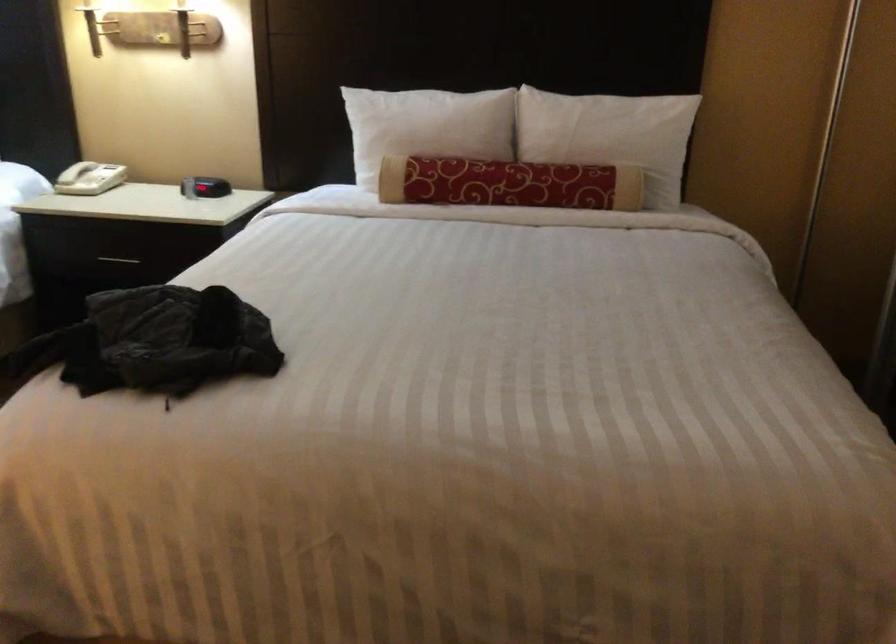
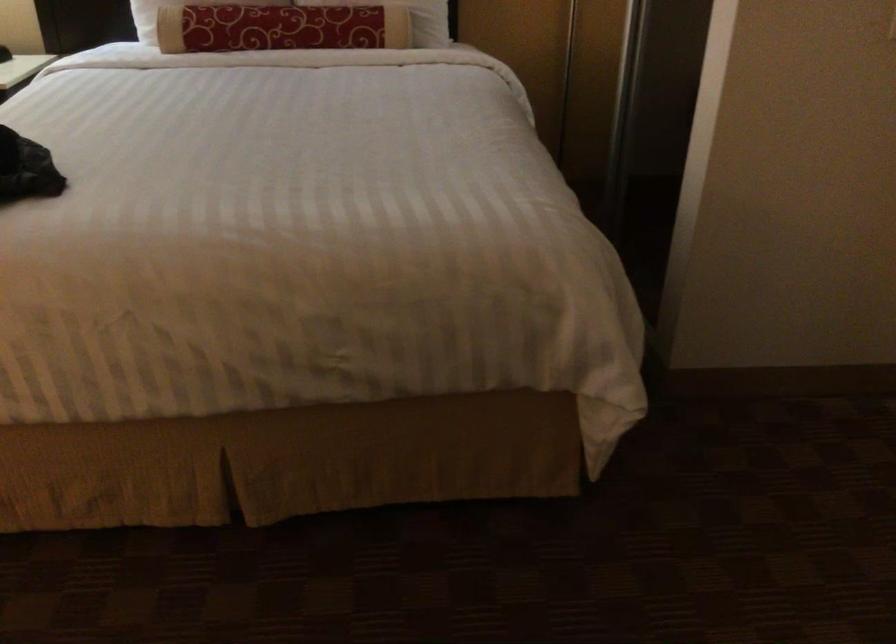
The point at (538,171) is marked in the first image. Where is the corresponding point in the second image?

(311, 15)